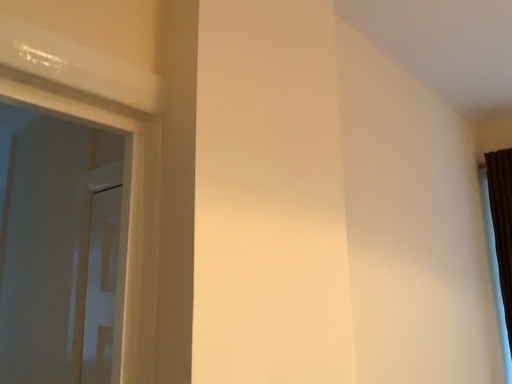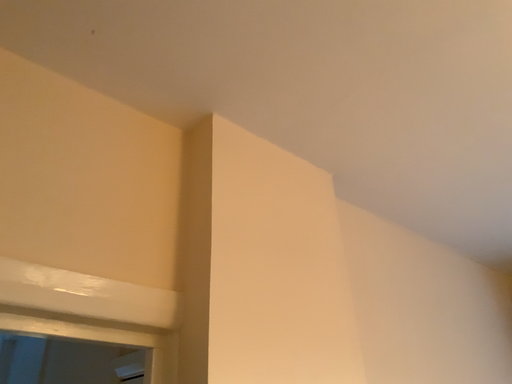
Question: How did the camera likely rotate when shooting the video?

Choices:
 (A) rotated downward
 (B) rotated upward

Answer: (B)